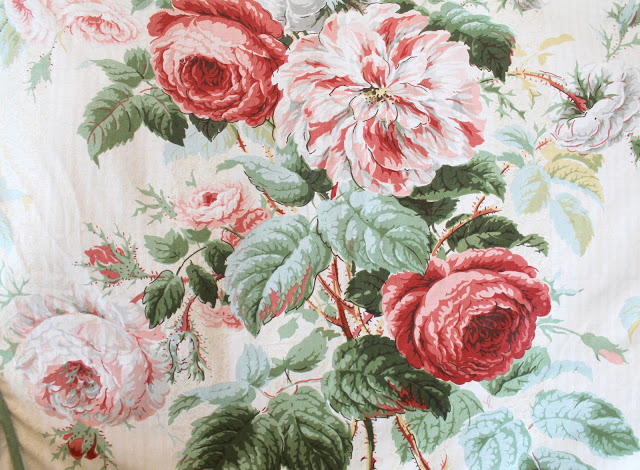
Where is `white comforter`? This screenshot has width=640, height=470. white comforter is located at coordinates (67, 197), (595, 271).